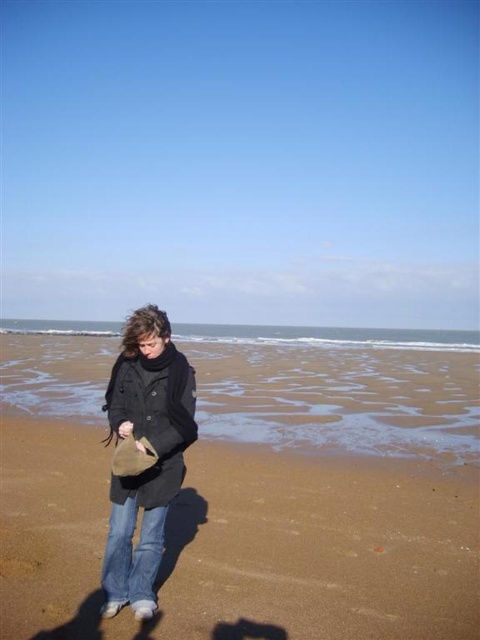
The height and width of the screenshot is (640, 480). Describe the element at coordinates (327, 486) in the screenshot. I see `sandy brown beach at center` at that location.

Which of these two, sandy brown beach at center or dark gray wool coat at center, stands taller?

Standing taller between the two is dark gray wool coat at center.

This screenshot has width=480, height=640. Find the location of `sandy brown beach at center`. sandy brown beach at center is located at coordinates (327, 486).

Can you confirm if sandy brown beach at center is shorter than denim at lower center?

Incorrect, sandy brown beach at center's height does not fall short of denim at lower center's.

Does sandy brown beach at center have a lesser width compared to denim at lower center?

In fact, sandy brown beach at center might be wider than denim at lower center.

This screenshot has height=640, width=480. What are the coordinates of `sandy brown beach at center` in the screenshot? It's located at (327, 486).

Can you confirm if dark gray wool coat at center is bigger than denim at lower center?

Yes, dark gray wool coat at center is bigger than denim at lower center.

Can you confirm if dark gray wool coat at center is positioned to the right of denim at lower center?

Indeed, dark gray wool coat at center is positioned on the right side of denim at lower center.

Is point (145, 618) closer to camera compared to point (116, 589)?

Yes, it is in front of point (116, 589).

You are a GUI agent. You are given a task and a screenshot of the screen. Output one action in this format:
    pyautogui.click(x=<x>, y=<y>)
    Task: Click on the dark gray wool coat at center
    The width and height of the screenshot is (480, 640).
    Given the screenshot: What is the action you would take?
    pyautogui.click(x=144, y=456)